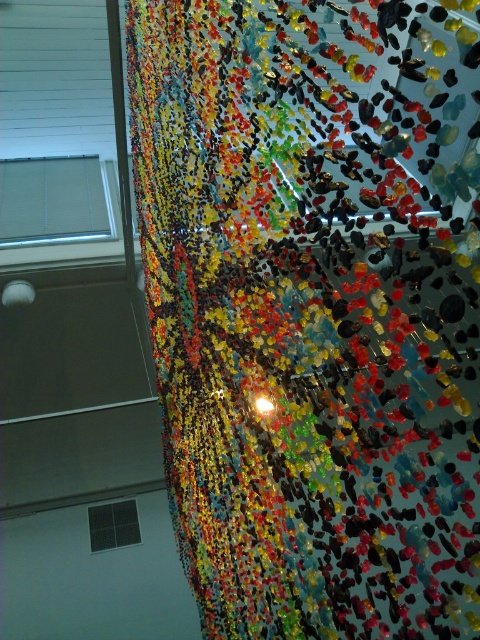
You are an art curator planning to install a new sculpture that requires hanging from the ceiling. You need to ensure that the sculpture will not block the view of the translucent glass confetti at upper center and the white blinds at upper left. Based on their positions, which object is lower and therefore might require the sculpture to be placed above it to avoid obstruction?

The translucent glass confetti at upper center is below the white blinds at upper left, so the sculpture should be placed above the translucent glass confetti at upper center to avoid blocking both objects.

You are an art installer who needs to know the spatial relationship between the white blinds at upper left and the black glass window at lower left. Which one is taller?

The white blinds at upper left is taller than black glass window at lower left.

You are an art curator planning to install a new sculpture in the gallery. You need to place a large, reflective sculpture that requires a clear space of at least 1 meter in diameter. Looking at the image, is there enough space at the point marked by point (307, 323) for this sculpture?

The point (307, 323) marks translucent glass confetti at upper center, so there is no clear space there. The area is occupied by the installation, making it unsuitable for placing the large reflective sculpture requiring 1 meter in diameter.